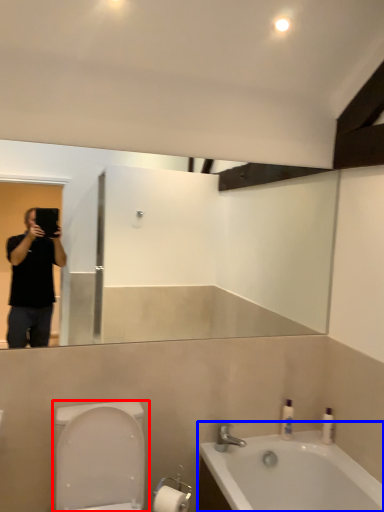
Question: Among these objects, which one is nearest to the camera, toilet (highlighted by a red box) or bathtub (highlighted by a blue box)?

Choices:
 (A) toilet
 (B) bathtub

Answer: (A)